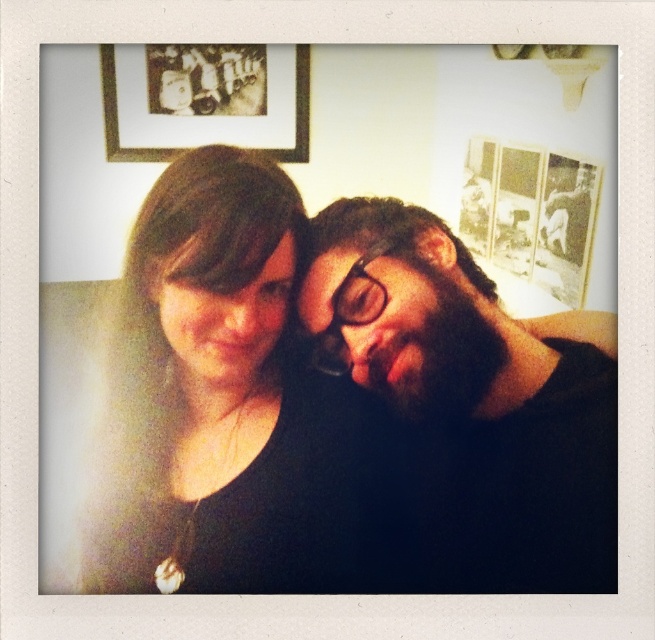
Question: Which object is positioned farthest from the matte black frame at upper left?

Choices:
 (A) dark brown hair at center
 (B) black matte hair at center

Answer: (A)

Question: Does black matte hair at center appear on the right side of matte black frame at upper left?

Choices:
 (A) yes
 (B) no

Answer: (A)

Question: Is black matte hair at center thinner than matte black frame at upper left?

Choices:
 (A) no
 (B) yes

Answer: (A)

Question: Does black matte hair at center have a greater width compared to dark brown hair at center?

Choices:
 (A) no
 (B) yes

Answer: (A)

Question: Which is nearer to the black matte hair at center?

Choices:
 (A) dark brown hair at center
 (B) matte black frame at upper left

Answer: (A)

Question: Which object appears closest to the camera in this image?

Choices:
 (A) black matte hair at center
 (B) matte black frame at upper left
 (C) dark brown hair at center

Answer: (B)